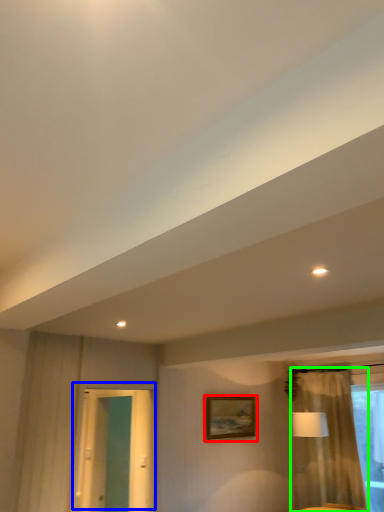
Question: Which object is the closest to the picture frame (highlighted by a red box)? Choose among these: door (highlighted by a blue box) or curtain (highlighted by a green box).

Choices:
 (A) door
 (B) curtain

Answer: (B)